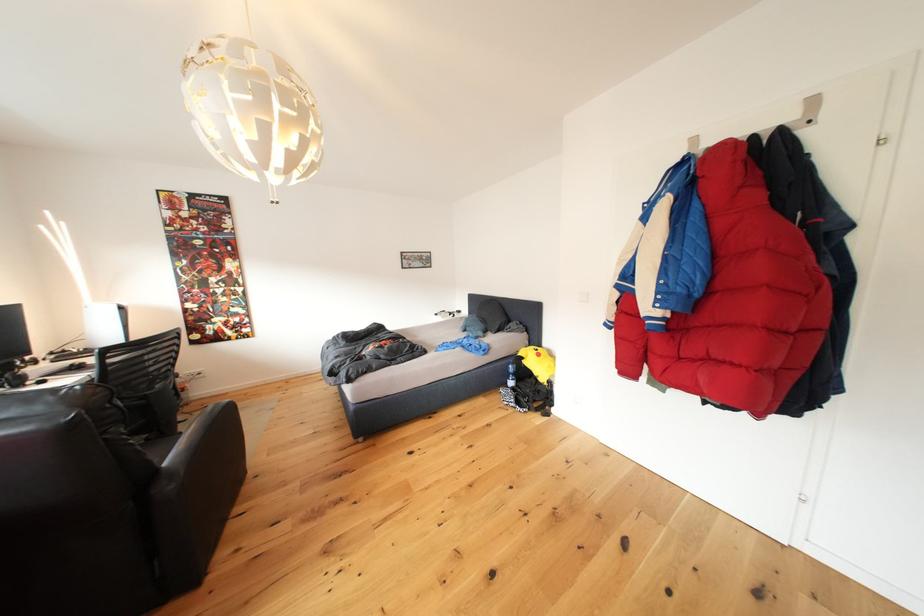
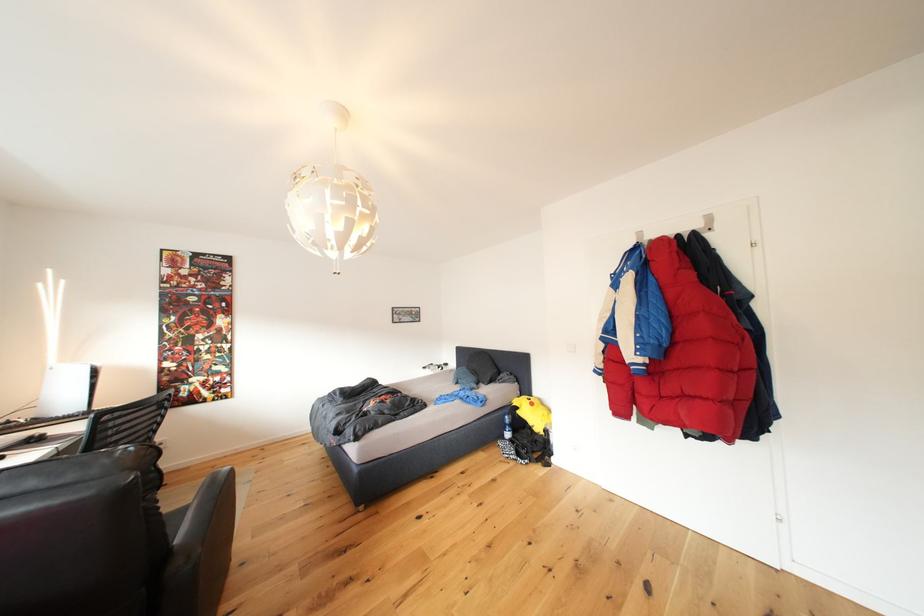
What movement of the cameraman would produce the second image?

The cameraman moved toward left, backward.